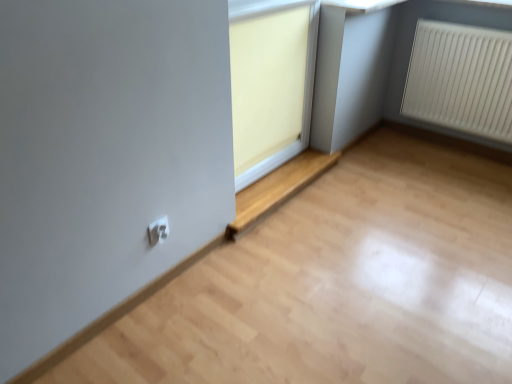
This screenshot has width=512, height=384. What do you see at coordinates (461, 79) in the screenshot?
I see `white plastic radiator at right` at bounding box center [461, 79].

Find the location of a particular element. Image resolution: width=512 pixels, height=384 pixels. matte wood window at center is located at coordinates (277, 188).

Can you confirm if matte wood window at center is wider than white plastic window frame at upper center?

Correct, the width of matte wood window at center exceeds that of white plastic window frame at upper center.

From the image's perspective, would you say matte wood window at center is shown under white plastic window frame at upper center?

Correct, matte wood window at center appears lower than white plastic window frame at upper center in the image.

What's the angular difference between matte wood window at center and white plastic window frame at upper center's facing directions?

The angular difference between matte wood window at center and white plastic window frame at upper center is 0.926 degrees.

Is matte wood window at center positioned before white plastic window frame at upper center?

No, matte wood window at center is behind white plastic window frame at upper center.

From the image's perspective, is white plastic window frame at upper center located above white plastic electric outlet at lower center?

Yes, from the image's perspective, white plastic window frame at upper center is above white plastic electric outlet at lower center.

Considering the relative sizes of white plastic window frame at upper center and white plastic electric outlet at lower center in the image provided, is white plastic window frame at upper center bigger than white plastic electric outlet at lower center?

Yes, white plastic window frame at upper center is bigger than white plastic electric outlet at lower center.

Which is further, (301, 49) or (167, 231)?

The point (301, 49) is farther.

Measure the distance from white plastic window frame at upper center to white plastic electric outlet at lower center.

white plastic window frame at upper center is 90.04 centimeters away from white plastic electric outlet at lower center.

Does white plastic window frame at upper center turn towards matte wood window at center?

No, white plastic window frame at upper center is not turned towards matte wood window at center.

From the image's perspective, would you say white plastic window frame at upper center is shown under matte wood window at center?

No, from the image's perspective, white plastic window frame at upper center is not below matte wood window at center.

Is point (251, 62) farther from viewer compared to point (290, 180)?

No, it is not.

Would you say white plastic window frame at upper center is inside or outside matte wood window at center?

white plastic window frame at upper center is not inside matte wood window at center, it's outside.

Is white plastic radiator at right with white plastic window frame at upper center?

They are not placed beside each other.

How different are the orientations of white plastic radiator at right and white plastic window frame at upper center in degrees?

The angular difference between white plastic radiator at right and white plastic window frame at upper center is 89 degrees.

From a real-world perspective, between white plastic radiator at right and white plastic window frame at upper center, who is vertically higher?

In real-world perspective, white plastic window frame at upper center is above.

Considering the sizes of objects white plastic radiator at right and white plastic window frame at upper center in the image provided, who is taller, white plastic radiator at right or white plastic window frame at upper center?

white plastic window frame at upper center.

Can you tell me how much matte wood window at center and white plastic radiator at right differ in facing direction?

The angle between the facing direction of matte wood window at center and the facing direction of white plastic radiator at right is 90 degrees.

Which of these two, matte wood window at center or white plastic radiator at right, is wider?

matte wood window at center is wider.

Between matte wood window at center and white plastic radiator at right, which one is positioned in front?

matte wood window at center.

Considering the sizes of objects matte wood window at center and white plastic radiator at right in the image provided, who is shorter, matte wood window at center or white plastic radiator at right?

matte wood window at center.

Considering the sizes of objects white plastic radiator at right and matte wood window at center in the image provided, who is wider, white plastic radiator at right or matte wood window at center?

With larger width is matte wood window at center.

Is white plastic radiator at right facing away from matte wood window at center?

white plastic radiator at right does not have its back to matte wood window at center.

Is white plastic radiator at right touching matte wood window at center?

No.

Does point (250, 105) come closer to viewer compared to point (474, 93)?

Yes.

The image size is (512, 384). Find the location of `radiator behind the white plastic window frame at upper center`. radiator behind the white plastic window frame at upper center is located at coordinates (461, 79).

Between white plastic window frame at upper center and white plastic radiator at right, which one has less height?

Standing shorter between the two is white plastic radiator at right.

The height and width of the screenshot is (384, 512). I want to click on window below the white plastic window frame at upper center (from a real-world perspective), so click(277, 188).

At what (x,y) coordinates should I click in order to perform the action: click on electric outlet in front of the white plastic window frame at upper center. Please return your answer as a coordinate pair (x, y). The image size is (512, 384). Looking at the image, I should click on (158, 231).

Looking at this image, based on their spatial positions, is white plastic electric outlet at lower center or matte wood window at center further from white plastic window frame at upper center?

white plastic electric outlet at lower center is positioned further to the anchor white plastic window frame at upper center.

From the image, which object appears to be farther from matte wood window at center, white plastic radiator at right or white plastic electric outlet at lower center?

white plastic radiator at right lies further to matte wood window at center than the other object.

Estimate the real-world distances between objects in this image. Which object is closer to white plastic window frame at upper center, white plastic radiator at right or white plastic electric outlet at lower center?

white plastic electric outlet at lower center lies closer to white plastic window frame at upper center than the other object.

Considering their positions, is matte wood window at center positioned closer to white plastic window frame at upper center than white plastic electric outlet at lower center?

Among the two, matte wood window at center is located nearer to white plastic window frame at upper center.

When comparing their distances from white plastic electric outlet at lower center, does matte wood window at center or white plastic window frame at upper center seem closer?

matte wood window at center lies closer to white plastic electric outlet at lower center than the other object.

Estimate the real-world distances between objects in this image. Which object is closer to white plastic electric outlet at lower center, matte wood window at center or white plastic radiator at right?

Among the two, matte wood window at center is located nearer to white plastic electric outlet at lower center.

Based on their spatial positions, is white plastic window frame at upper center or white plastic electric outlet at lower center further from white plastic radiator at right?

The object further to white plastic radiator at right is white plastic electric outlet at lower center.

When comparing their distances from white plastic electric outlet at lower center, does white plastic radiator at right or white plastic window frame at upper center seem further?

white plastic radiator at right is positioned further to the anchor white plastic electric outlet at lower center.

The width and height of the screenshot is (512, 384). In order to click on window between white plastic electric outlet at lower center and white plastic radiator at right in the horizontal direction in this screenshot , I will do `click(277, 188)`.

The height and width of the screenshot is (384, 512). Identify the location of window between white plastic window frame at upper center and white plastic radiator at right in the horizontal direction. (277, 188).

Locate an element on the screen. The image size is (512, 384). window frame between white plastic electric outlet at lower center and white plastic radiator at right in the horizontal direction is located at coordinates (271, 82).

Locate an element on the screen. The width and height of the screenshot is (512, 384). window that lies between white plastic window frame at upper center and white plastic electric outlet at lower center from top to bottom is located at coordinates click(277, 188).